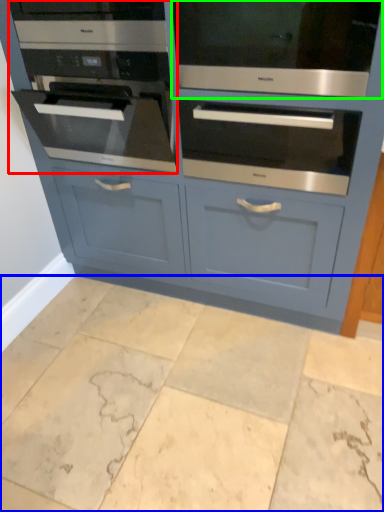
Question: Which object is positioned farthest from oven (highlighted by a red box)? Select from ceramic tile (highlighted by a blue box) and oven (highlighted by a green box).

Choices:
 (A) ceramic tile
 (B) oven

Answer: (A)